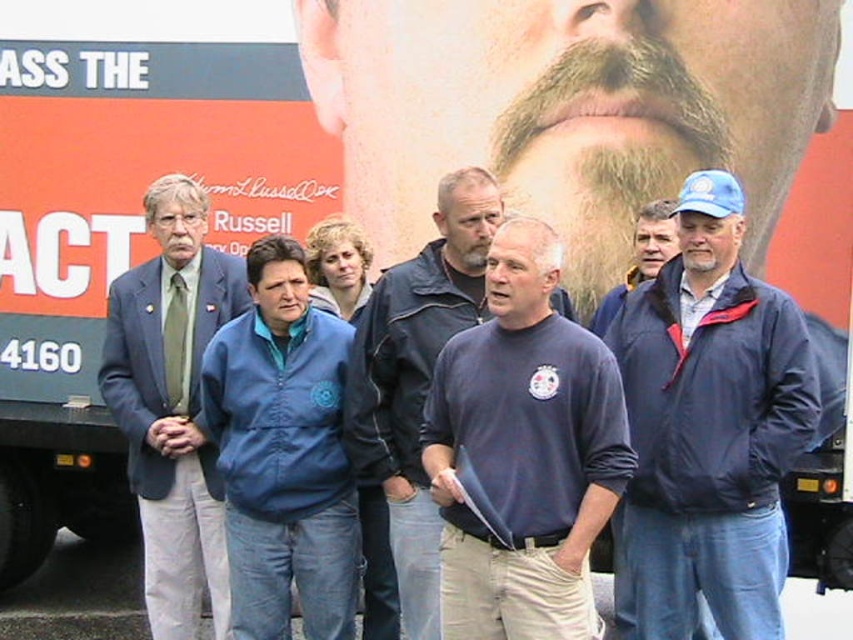
Is point (508, 228) farther from camera compared to point (105, 403)?

That is False.

The height and width of the screenshot is (640, 853). What do you see at coordinates (524, 451) in the screenshot?
I see `dark blue sweatshirt at center` at bounding box center [524, 451].

In the scene shown: Measure the distance between point (494, 296) and camera.

The distance of point (494, 296) from camera is 7.27 meters.

Locate an element on the screen. This screenshot has height=640, width=853. dark blue sweatshirt at center is located at coordinates (524, 451).

Does dark blue sweatshirt at center appear on the right side of blue fabric jacket at center?

Indeed, dark blue sweatshirt at center is positioned on the right side of blue fabric jacket at center.

Is dark blue sweatshirt at center behind blue fabric jacket at center?

No, it is in front of blue fabric jacket at center.

Does point (572, 506) come behind point (318, 577)?

No, (572, 506) is closer to viewer.

Find the location of `dark blue sweatshirt at center`. dark blue sweatshirt at center is located at coordinates [524, 451].

Does blue fabric jacket at left have a greater width compared to blue jacket at center?

Yes, blue fabric jacket at left is wider than blue jacket at center.

Is point (196, 452) closer to camera compared to point (664, 227)?

No, (196, 452) is further to viewer.

This screenshot has height=640, width=853. Find the location of `blue fabric jacket at left`. blue fabric jacket at left is located at coordinates coord(172,403).